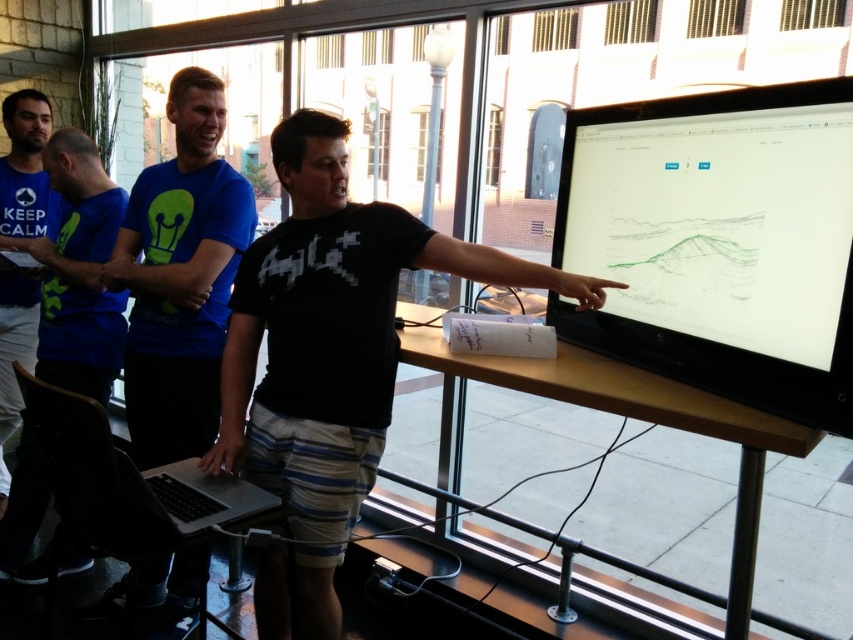
Question: Among these points, which one is farthest from the camera?

Choices:
 (A) (157, 595)
 (B) (682, 284)
 (C) (317, 424)
 (D) (517, 524)

Answer: (D)

Question: Can you confirm if wooden at center is positioned above blue t-shirt at left?

Choices:
 (A) yes
 (B) no

Answer: (B)

Question: Can you confirm if blue matte shirt at center is positioned above blue fabric shirt at left?

Choices:
 (A) no
 (B) yes

Answer: (A)

Question: Does blue fabric shirt at left come in front of silver metallic laptop at lower left?

Choices:
 (A) yes
 (B) no

Answer: (B)

Question: Estimate the real-world distances between objects in this image. Which object is farther from the blue matte shirt at center?

Choices:
 (A) matte black monitor at right
 (B) wooden at center
 (C) blue fabric shirt at left

Answer: (A)

Question: Which object is farther from the camera taking this photo?

Choices:
 (A) silver metallic laptop at lower left
 (B) blue t-shirt at left
 (C) blue matte shirt at center

Answer: (B)